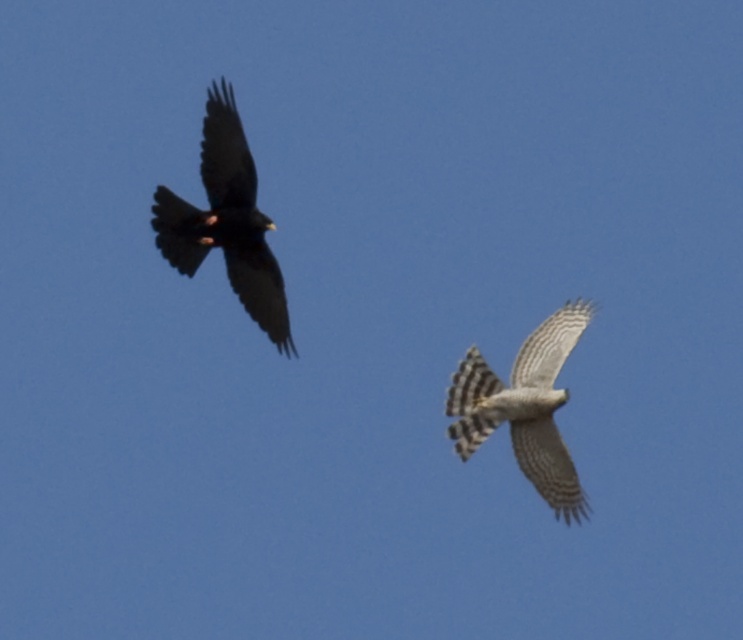
Is dark brown feathers at left positioned in front of gray striped feathers at center?

Yes.

Does point (253, 193) come farther from viewer compared to point (551, 413)?

No, it is in front of (551, 413).

Where is `dark brown feathers at left`? The image size is (743, 640). dark brown feathers at left is located at coordinates (227, 220).